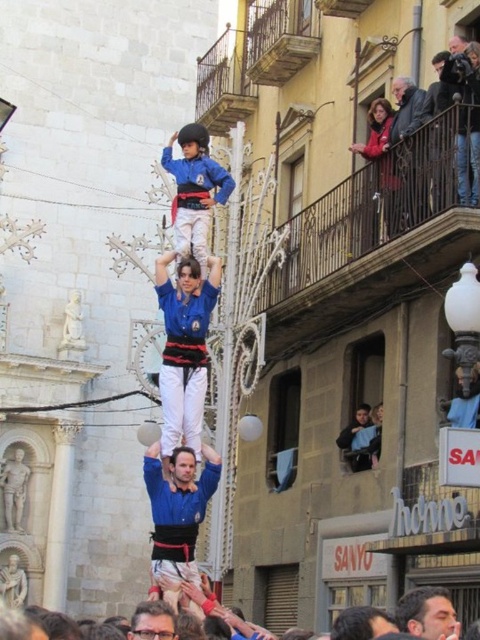
Does blue fabric man at center have a greater height compared to blue fabric shirt at center?

Correct, blue fabric man at center is much taller as blue fabric shirt at center.

Does blue fabric man at center appear over blue fabric shirt at center?

Actually, blue fabric man at center is below blue fabric shirt at center.

Is point (168, 580) farther from camera compared to point (175, 627)?

Yes, it is.

At what (x,y) coordinates should I click in order to perform the action: click on blue fabric man at center. Please return your answer as a coordinate pair (x, y). This screenshot has height=640, width=480. Looking at the image, I should click on [x=178, y=515].

Who is more distant from viewer, [169,147] or [33,614]?

The point [169,147] is more distant.

Between matte blue uniform at center and white cotton crowd at lower center, which one has more height?

white cotton crowd at lower center

Find the location of a particular element. matte blue uniform at center is located at coordinates (194, 189).

The image size is (480, 640). I want to click on matte blue uniform at center, so click(194, 189).

Image resolution: width=480 pixels, height=640 pixels. Find the location of `matte blue shirt at center`. matte blue shirt at center is located at coordinates (183, 349).

Is matte blue shirt at center shorter than blue fabric shirt at center?

No.

You are a GUI agent. You are given a task and a screenshot of the screen. Output one action in this format:
    pyautogui.click(x=<x>, y=<y>)
    Task: Click on the matte blue shirt at center
    This screenshot has width=480, height=640.
    Given the screenshot: What is the action you would take?
    [x=183, y=349]

Image resolution: width=480 pixels, height=640 pixels. What are the coordinates of `matte blue shirt at center` in the screenshot? It's located at (183, 349).